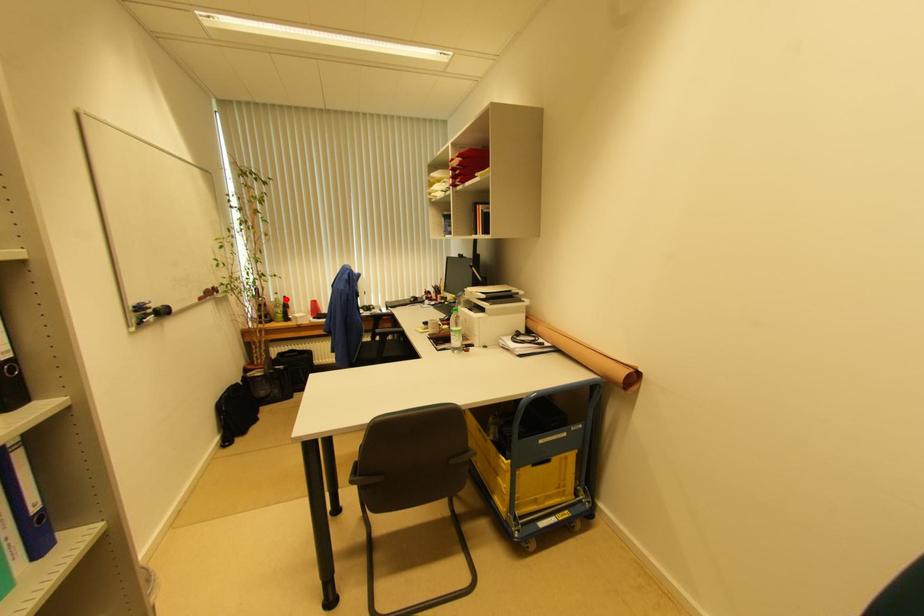
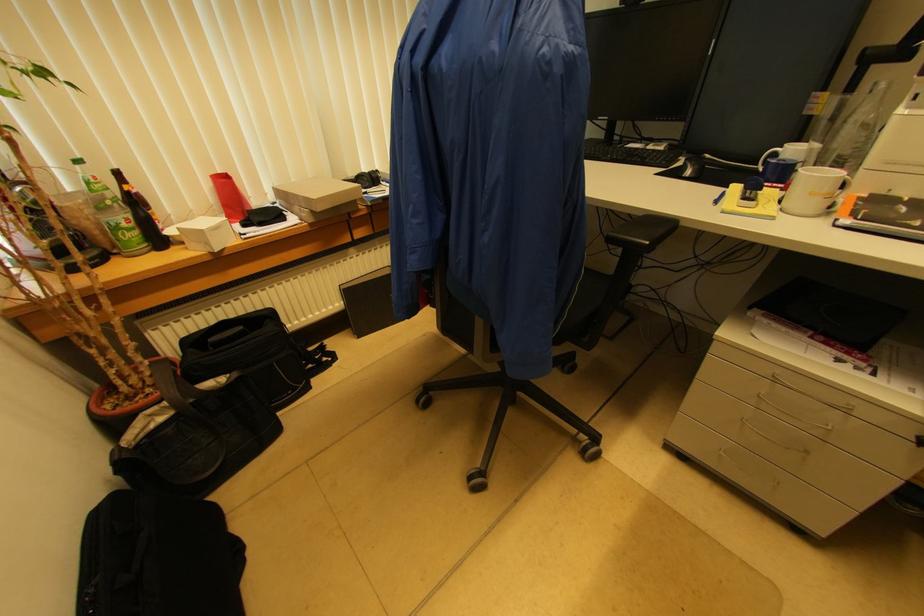
Question: I am providing you with two images of the same scene from different viewpoints. In image1, a red point is highlighted. Considering the same 3D point in image2, which of the following is correct?

Choices:
 (A) It is closer
 (B) It is farther

Answer: (B)